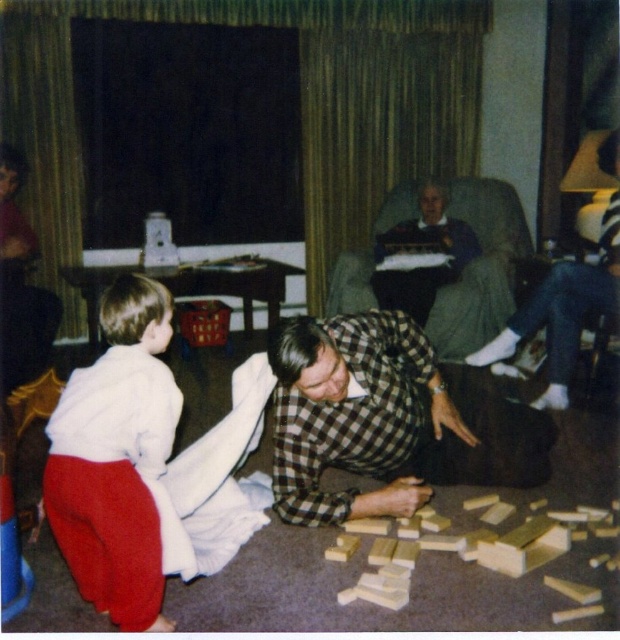
The height and width of the screenshot is (640, 620). What do you see at coordinates (386, 419) in the screenshot?
I see `checkered fabric shirt at center` at bounding box center [386, 419].

Which is behind, point (391, 410) or point (140, 369)?

Positioned behind is point (391, 410).

This screenshot has height=640, width=620. Find the location of `checkered fabric shirt at center`. checkered fabric shirt at center is located at coordinates (386, 419).

Is white cotton shirt at lower left to the right of gray fabric armchair at center from the viewer's perspective?

Incorrect, white cotton shirt at lower left is not on the right side of gray fabric armchair at center.

Which of these two, white cotton shirt at lower left or gray fabric armchair at center, stands taller?

Standing taller between the two is gray fabric armchair at center.

Does point (99, 308) come behind point (477, 301)?

No, (99, 308) is in front of (477, 301).

In order to click on white cotton shirt at lower left in this screenshot , I will do `click(117, 458)`.

Who is lower down, checkered fabric shirt at center or gray fabric armchair at center?

checkered fabric shirt at center is lower down.

Is point (366, 440) behind point (347, 256)?

No, (366, 440) is closer to viewer.

Image resolution: width=620 pixels, height=640 pixels. In order to click on checkered fabric shirt at center in this screenshot , I will do `click(386, 419)`.